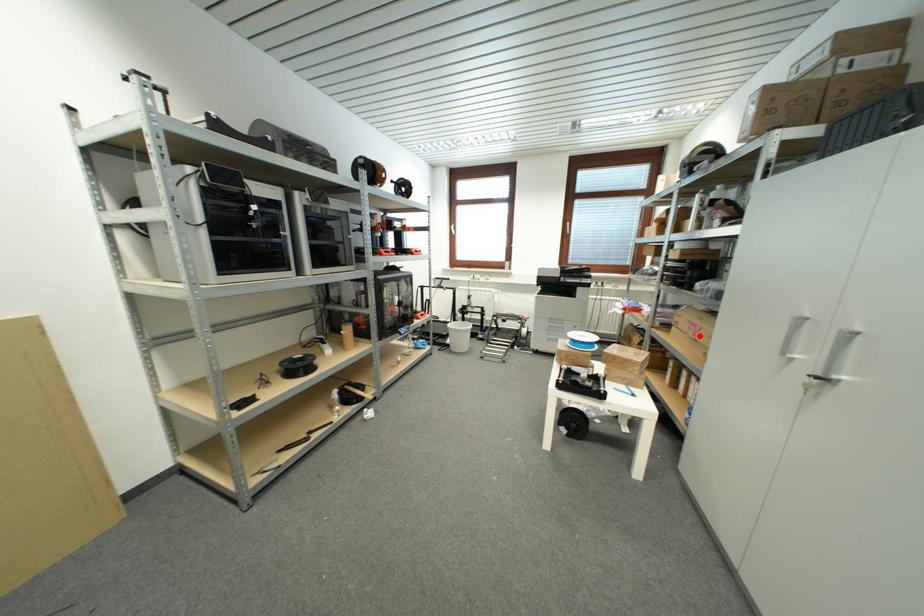
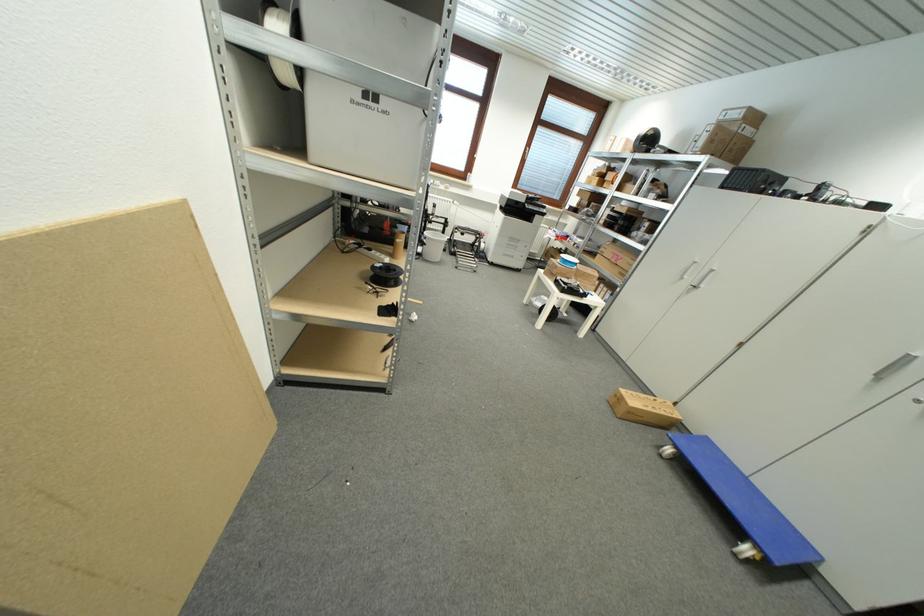
Question: I am providing you with two images of the same scene from different viewpoints. A red point is marked on the first image. Can you still see the location of the red point in image 2?

Choices:
 (A) Yes
 (B) No

Answer: (A)